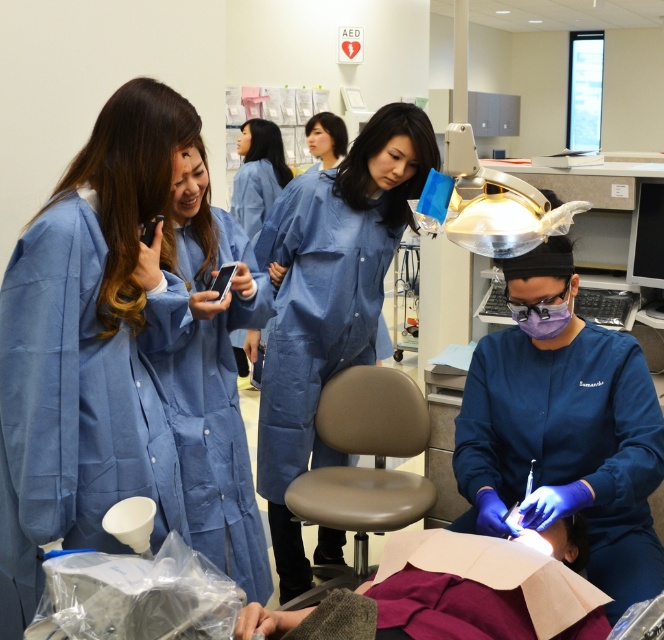
Is blue smooth uniform at center bigger than purple matte mask at center?

Indeed, blue smooth uniform at center has a larger size compared to purple matte mask at center.

Does blue smooth uniform at center have a lesser width compared to purple matte mask at center?

No.

Where is `blue smooth uniform at center`? blue smooth uniform at center is located at coordinates (258, 173).

Can you confirm if blue smooth lab coat at left is shorter than blue fabric coat at center?

Indeed, blue smooth lab coat at left has a lesser height compared to blue fabric coat at center.

Looking at this image, measure the distance between blue smooth lab coat at left and blue fabric coat at center.

The distance of blue smooth lab coat at left from blue fabric coat at center is 36.52 inches.

Which is behind, point (139, 141) or point (305, 212)?

Positioned behind is point (305, 212).

At what (x,y) coordinates should I click in order to perform the action: click on blue smooth lab coat at left. Please return your answer as a coordinate pair (x, y). This screenshot has height=640, width=664. Looking at the image, I should click on (90, 346).

Is blue smooth uniform at center wider than matte black phone at center?

Yes.

Is point (250, 134) closer to viewer compared to point (232, 266)?

No, (250, 134) is further to viewer.

Between point (282, 182) and point (230, 264), which one is positioned in front?

Point (230, 264) is in front.

At what (x,y) coordinates should I click in order to perform the action: click on blue smooth uniform at center. Please return your answer as a coordinate pair (x, y). Image resolution: width=664 pixels, height=640 pixels. Looking at the image, I should click on (258, 173).